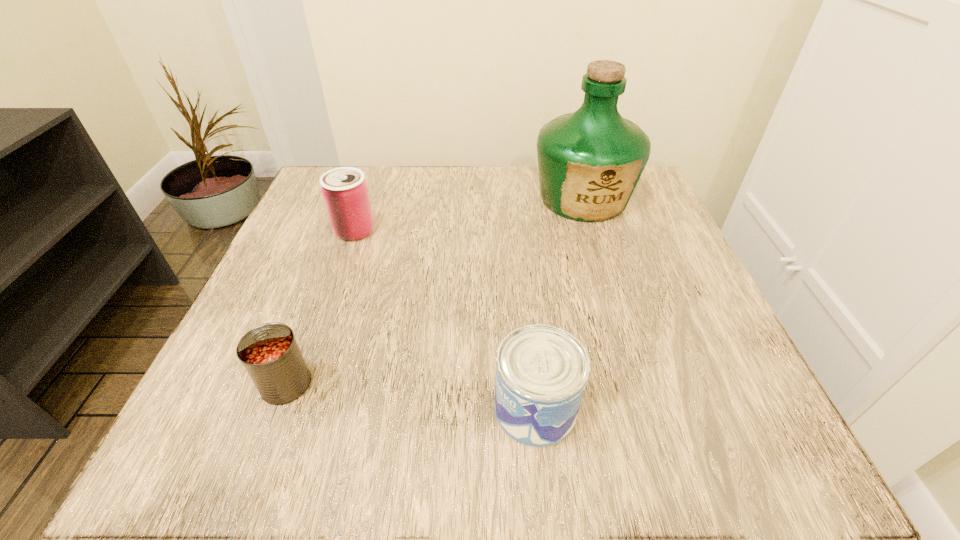
You are a GUI agent. You are given a task and a screenshot of the screen. Output one action in this format:
    pyautogui.click(x=<x>, y=<y>)
    Task: Click on the object that is positioned at the right edge
    
    Given the screenshot: What is the action you would take?
    pyautogui.click(x=590, y=161)

Identify the location of object positioned at the far left corner. The image size is (960, 540). (345, 192).

You are a GUI agent. You are given a task and a screenshot of the screen. Output one action in this format:
    pyautogui.click(x=<x>, y=<y>)
    Task: Click on the object that is at the near left corner
    The height and width of the screenshot is (540, 960).
    Given the screenshot: What is the action you would take?
    pyautogui.click(x=269, y=352)

Locate an element on the screen. Image resolution: width=960 pixels, height=540 pixels. object situated at the far right corner is located at coordinates (590, 161).

Locate an element on the screen. vacant area at the far edge of the desktop is located at coordinates (452, 190).

The width and height of the screenshot is (960, 540). In the image, there is a desktop. In order to click on vacant region at the near edge in this screenshot , I will do `click(371, 436)`.

Locate an element on the screen. Image resolution: width=960 pixels, height=540 pixels. vacant region at the left edge of the desktop is located at coordinates (288, 257).

You are a GUI agent. You are given a task and a screenshot of the screen. Output one action in this format:
    pyautogui.click(x=<x>, y=<y>)
    Task: Click on the blank space at the right edge
    The image size is (960, 540).
    Given the screenshot: What is the action you would take?
    pyautogui.click(x=725, y=332)

Where is `vacant region at the far left corner of the desktop`? This screenshot has height=540, width=960. vacant region at the far left corner of the desktop is located at coordinates (317, 179).

Where is `free space at the near right corner of the desktop`? free space at the near right corner of the desktop is located at coordinates (740, 420).